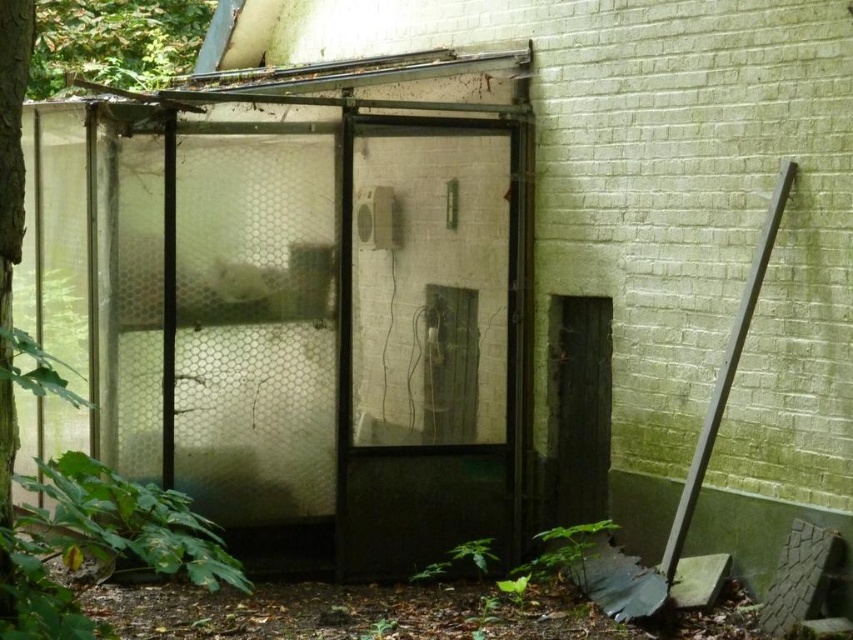
Does transparent plastic screen door at center have a greater width compared to dark gray metal shovel at right?

Correct, the width of transparent plastic screen door at center exceeds that of dark gray metal shovel at right.

Find the location of `transparent plastic screen door at center`. transparent plastic screen door at center is located at coordinates (425, 339).

Which is more to the left, transparent plastic cage at center or dark gray metal shovel at right?

From the viewer's perspective, transparent plastic cage at center appears more on the left side.

Is the position of transparent plastic cage at center more distant than that of dark gray metal shovel at right?

Yes, it is behind dark gray metal shovel at right.

Who is more forward, (120, 216) or (698, 442)?

Point (698, 442) is more forward.

Locate an element on the screen. This screenshot has width=853, height=640. transparent plastic cage at center is located at coordinates (318, 324).

How much distance is there between transparent plastic cage at center and transparent plastic screen door at center?

transparent plastic cage at center is 9.40 inches away from transparent plastic screen door at center.

Is point (329, 308) more distant than point (347, 205)?

Yes, point (329, 308) is behind point (347, 205).

You are a GUI agent. You are given a task and a screenshot of the screen. Output one action in this format:
    pyautogui.click(x=<x>, y=<y>)
    Task: Click on the transparent plastic cage at center
    
    Given the screenshot: What is the action you would take?
    pyautogui.click(x=318, y=324)